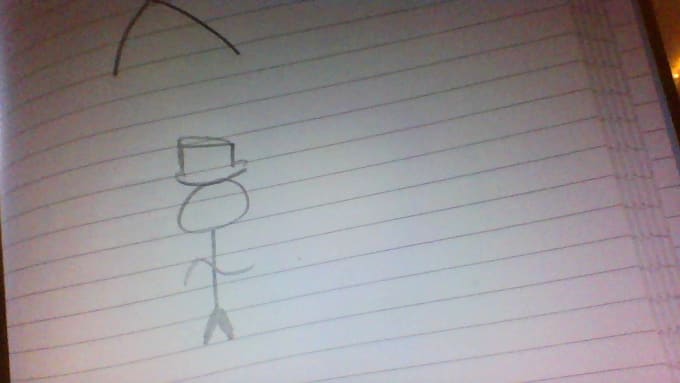
Image resolution: width=680 pixels, height=383 pixels. Identify the location of stack of pages inside of book. (623, 128).